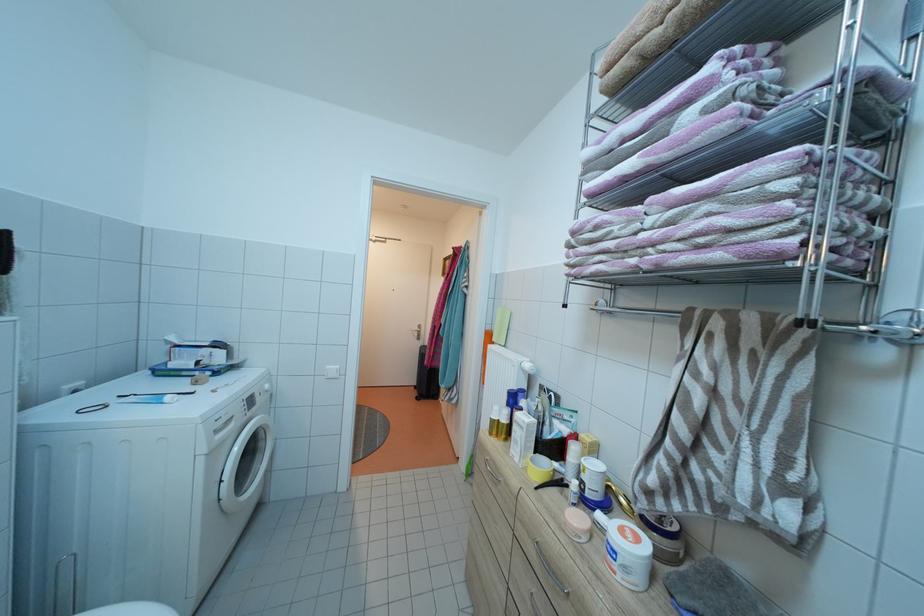
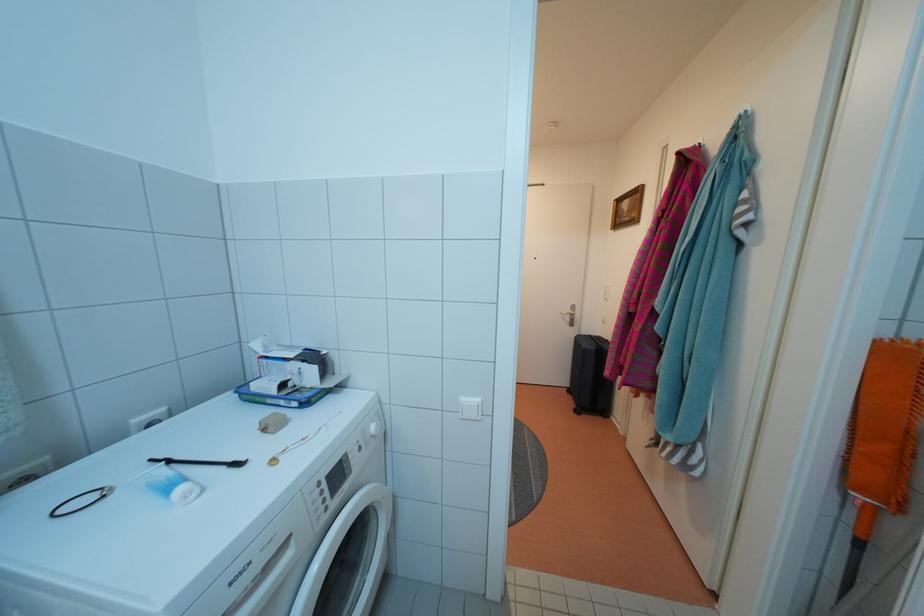
Find the pixel in the second image that matches (x=422, y=392) in the first image.

(576, 397)